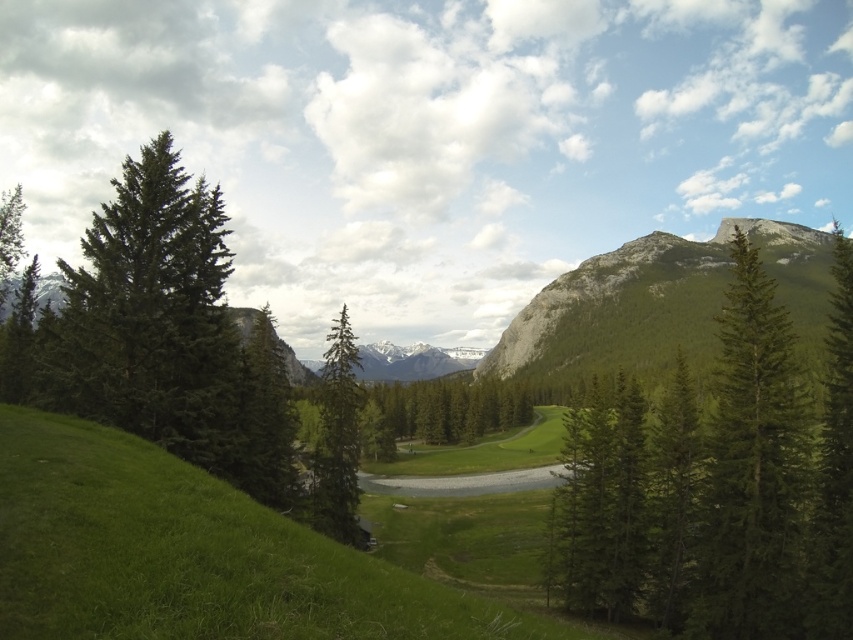
Can you confirm if green matte tree at right is smaller than white snow-covered mountain at center?

Indeed, green matte tree at right has a smaller size compared to white snow-covered mountain at center.

Who is more distant from viewer, (741, 292) or (320, 362)?

The point (320, 362) is behind.

Who is more distant from viewer, [792,436] or [430,348]?

The point [430,348] is behind.

Identify the location of green matte tree at right. (752, 467).

Does green matte tree at right lie behind green textured tree at right?

Yes, green matte tree at right is behind green textured tree at right.

Does point (758, 326) lie in front of point (837, 568)?

No, (758, 326) is behind (837, 568).

Locate an element on the screen. green matte tree at right is located at coordinates (752, 467).

Can you confirm if green textured mountain at center is positioned below green matte tree at center?

No, green textured mountain at center is not below green matte tree at center.

What do you see at coordinates (654, 304) in the screenshot? I see `green textured mountain at center` at bounding box center [654, 304].

This screenshot has height=640, width=853. Identify the location of green textured mountain at center. (654, 304).